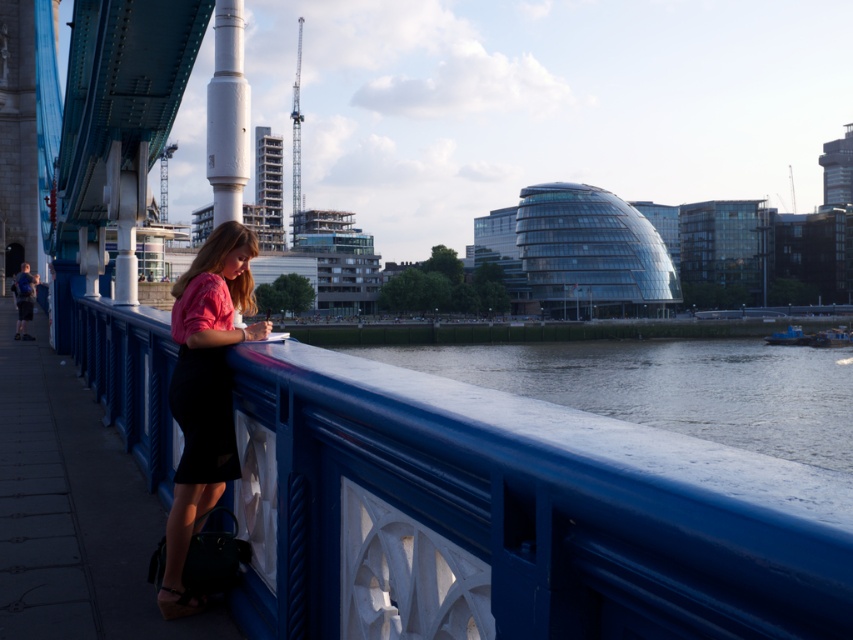
You are standing on the blue painted wood at center and want to reach the blue smooth water at lower center. In which direction should you move to get there?

You should move to the right because the blue painted wood at center is to the left of the blue smooth water at lower center.